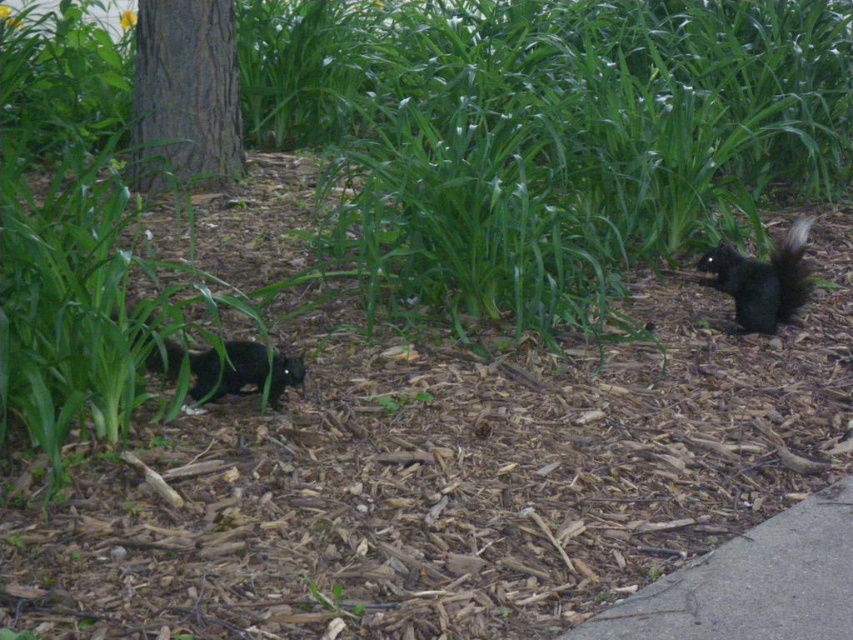
Which is more to the left, gray concrete pavement at lower right or black furry tail at right?

gray concrete pavement at lower right is more to the left.

Does gray concrete pavement at lower right come in front of black furry tail at right?

Yes.

Identify the location of gray concrete pavement at lower right. Image resolution: width=853 pixels, height=640 pixels. (751, 582).

This screenshot has width=853, height=640. In order to click on gray concrete pavement at lower right in this screenshot , I will do `click(751, 582)`.

Does gray concrete pavement at lower right have a greater height compared to black furry squirrel at right?

No, gray concrete pavement at lower right is not taller than black furry squirrel at right.

Locate an element on the screen. gray concrete pavement at lower right is located at coordinates (751, 582).

At what (x,y) coordinates should I click in order to perform the action: click on gray concrete pavement at lower right. Please return your answer as a coordinate pair (x, y). The width and height of the screenshot is (853, 640). Looking at the image, I should click on (751, 582).

Which is in front, point (751, 282) or point (784, 243)?

Point (751, 282)

Is point (776, 330) positioned in front of point (788, 294)?

No.

At what (x,y) coordinates should I click in order to perform the action: click on black furry squirrel at right. Please return your answer as a coordinate pair (x, y). The image size is (853, 640). Looking at the image, I should click on (762, 280).